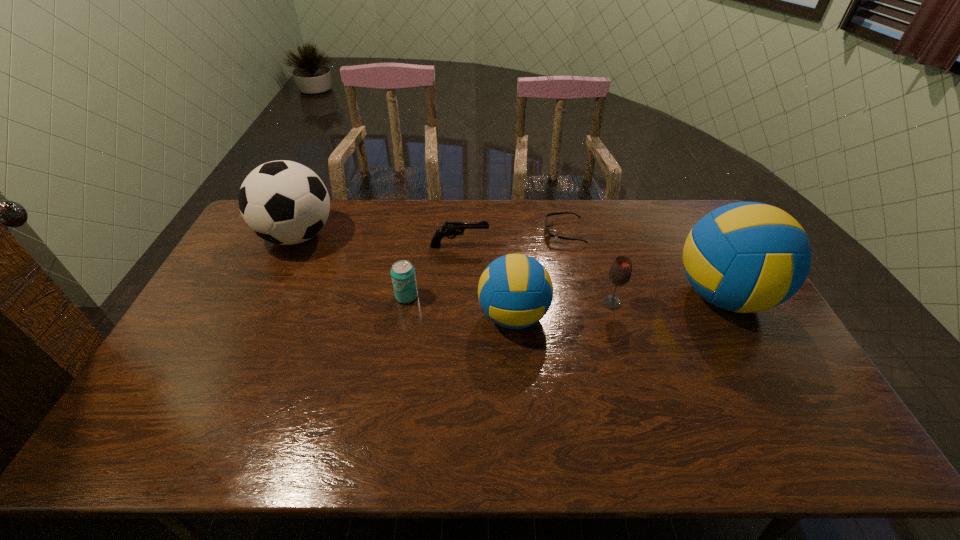
At what (x,y) coordinates should I click in order to perform the action: click on free spot located 0.260m on the left of the taller volleyball. Please return your answer as a coordinate pair (x, y). The height and width of the screenshot is (540, 960). Looking at the image, I should click on (588, 295).

I want to click on vacant space located on the front of the leftmost object, so click(263, 309).

Locate an element on the screen. vacant space located on the front-facing side of the sunglasses is located at coordinates (531, 232).

The image size is (960, 540). What are the coordinates of `vacant space situated 0.250m on the front-facing side of the sunglasses` in the screenshot? It's located at [x=475, y=232].

The height and width of the screenshot is (540, 960). I want to click on vacant area located 0.070m on the front-facing side of the sunglasses, so click(525, 232).

Find the location of a particular element. Image resolution: width=960 pixels, height=540 pixels. vacant space located 0.190m at the end of the barrel of the gun is located at coordinates (543, 246).

Where is `free space located on the left of the beer can`? The height and width of the screenshot is (540, 960). free space located on the left of the beer can is located at coordinates (266, 296).

Where is `blank space located on the right of the glass drink container`? The image size is (960, 540). blank space located on the right of the glass drink container is located at coordinates (667, 302).

This screenshot has height=540, width=960. What are the coordinates of `soccer ball that is at the far edge` in the screenshot? It's located at (283, 202).

Locate an element on the screen. The width and height of the screenshot is (960, 540). sunglasses that is at the far edge is located at coordinates [x=549, y=234].